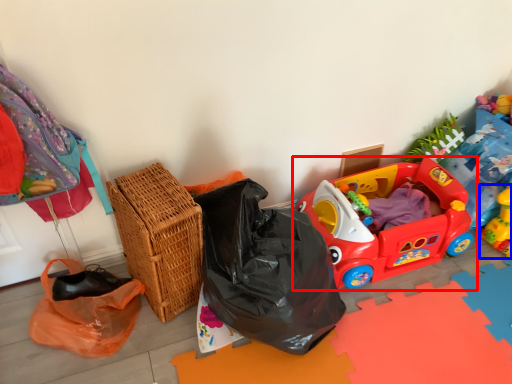
Question: Which object appears closest to the camera in this image, toy (highlighted by a red box) or toy (highlighted by a blue box)?

Choices:
 (A) toy
 (B) toy

Answer: (A)